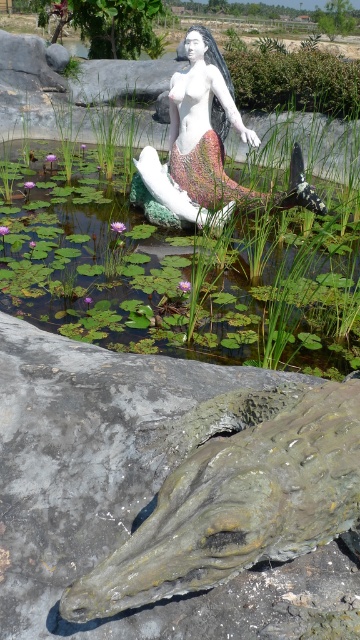
Question: Which point is closer to the camera?

Choices:
 (A) (312, 564)
 (B) (206, 129)

Answer: (A)

Question: Does green leafy water at center have a smaller size compared to white glossy mermaid at center?

Choices:
 (A) yes
 (B) no

Answer: (B)

Question: Is green leafy water at center positioned in front of white glossy mermaid at center?

Choices:
 (A) yes
 (B) no

Answer: (A)

Question: Is green leafy water at center wider than gray rough stone at lower center?

Choices:
 (A) yes
 (B) no

Answer: (A)

Question: Which point is farther to the camera?

Choices:
 (A) (104, 248)
 (B) (198, 84)

Answer: (B)

Question: Which of the following is the farthest from the observer?

Choices:
 (A) white glossy mermaid at center
 (B) gray rough stone at lower center
 (C) green leafy water at center

Answer: (A)